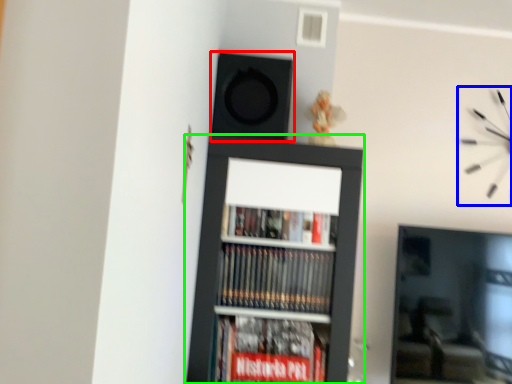
Question: Considering the real-world distances, which object is farthest from speaker (highlighted by a red box)? clock (highlighted by a blue box) or bookcase (highlighted by a green box)?

Choices:
 (A) clock
 (B) bookcase

Answer: (A)